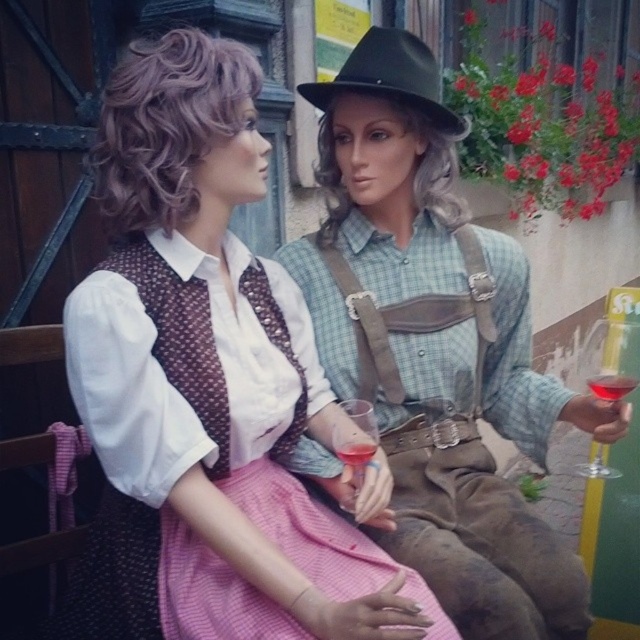
Is translucent glass wine at center further to the viewer compared to translucent glass wine at right?

No, translucent glass wine at center is closer to the viewer.

Can you confirm if translucent glass wine at center is thinner than translucent glass wine at right?

Yes, translucent glass wine at center is thinner than translucent glass wine at right.

Does point (349, 406) come behind point (604, 388)?

Yes.

Image resolution: width=640 pixels, height=640 pixels. In order to click on translucent glass wine at center in this screenshot , I will do `click(362, 416)`.

Is point (321, 180) more distant than point (371, 456)?

Yes.

Who is lower down, gray synthetic wig at center or translucent glass wine at center?

Positioned lower is translucent glass wine at center.

In order to click on gray synthetic wig at center in this screenshot , I will do tap(384, 164).

The width and height of the screenshot is (640, 640). Describe the element at coordinates (209, 387) in the screenshot. I see `matte white blouse at center` at that location.

Is matte white blouse at center to the right of translucent glass wine glass at right from the viewer's perspective?

Incorrect, matte white blouse at center is not on the right side of translucent glass wine glass at right.

Is point (284, 384) closer to viewer compared to point (595, 332)?

Yes, point (284, 384) is in front of point (595, 332).

The height and width of the screenshot is (640, 640). I want to click on matte white blouse at center, so click(209, 387).